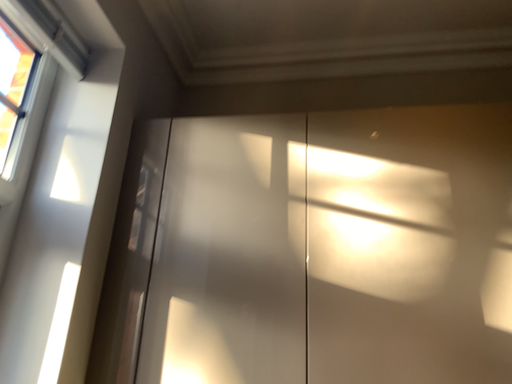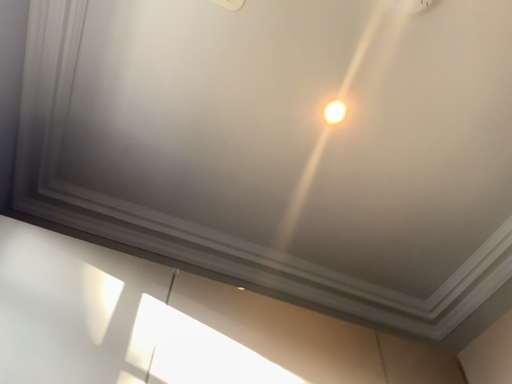
Question: How did the camera likely rotate when shooting the video?

Choices:
 (A) rotated left
 (B) rotated right

Answer: (B)